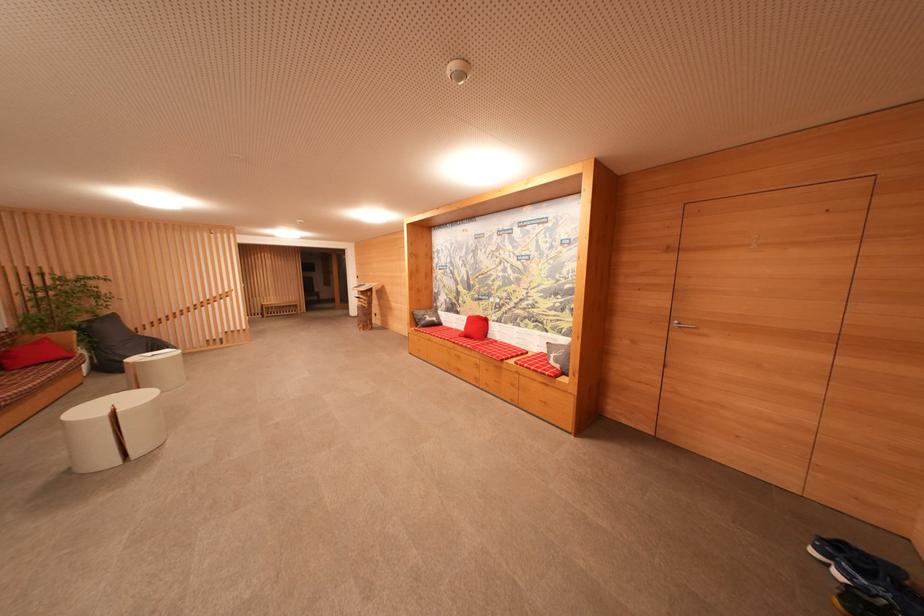
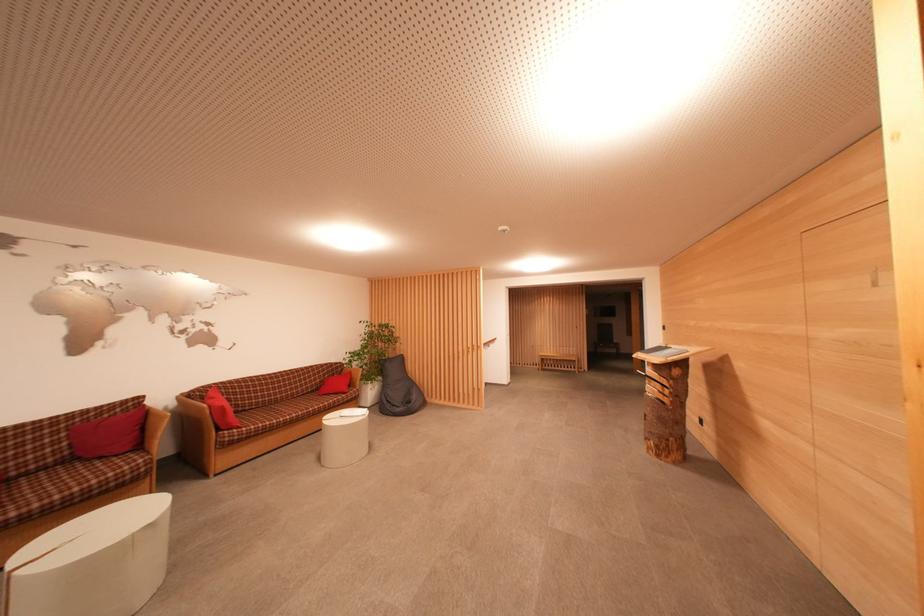
Where in the second image is the point corresponding to point (108, 315) from the first image?

(402, 357)